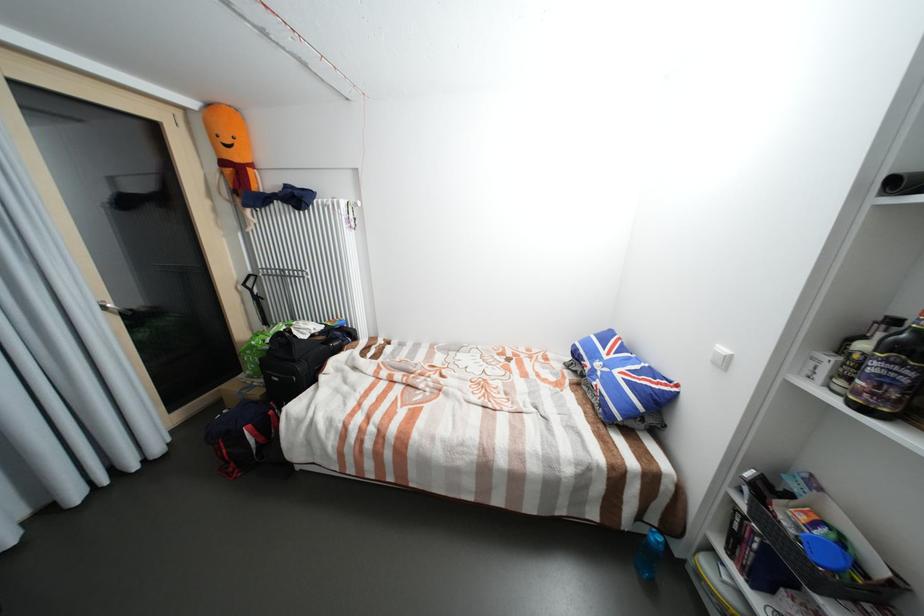
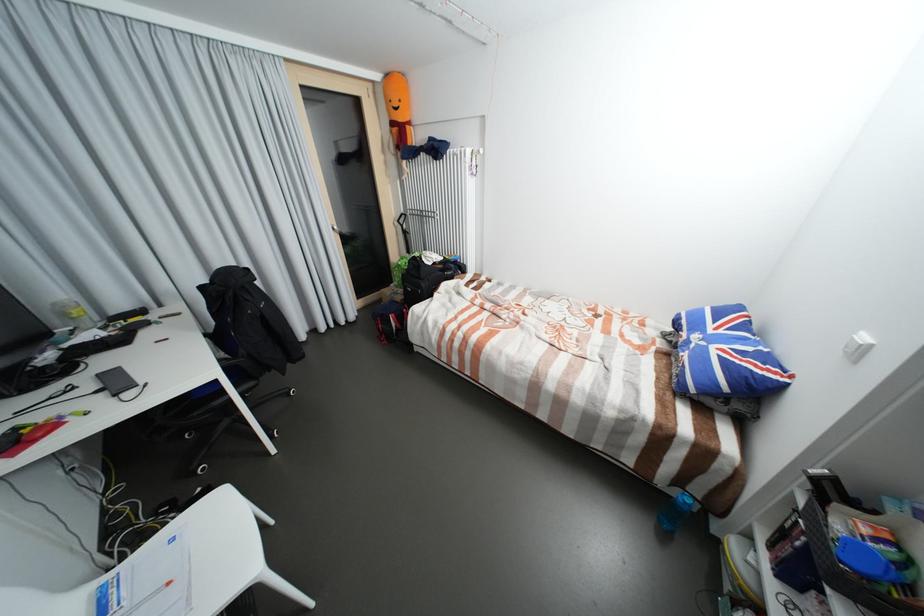
Question: The camera is either moving clockwise (left) or counter-clockwise (right) around the object. The first image is from the beginning of the video and the second image is from the end. Is the camera moving left or right when shooting the video?

Choices:
 (A) Left
 (B) Right

Answer: (B)